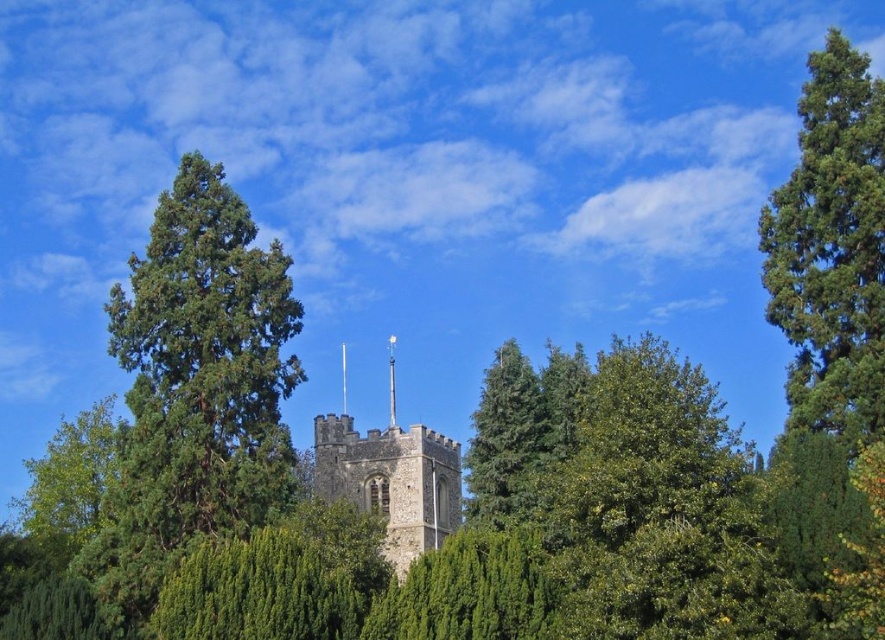
Can you confirm if green textured tree at left is thinner than green leafy tree at left?

Correct, green textured tree at left's width is less than green leafy tree at left's.

Is point (149, 432) farther from viewer compared to point (31, 477)?

No, (149, 432) is in front of (31, 477).

Identify the location of green textured tree at left. (195, 388).

Does point (378, 458) come closer to viewer compared to point (27, 531)?

That is False.

Locate an element on the screen. stone tower at center is located at coordinates (391, 476).

Is green textured tree at left below green textured pine tree at right?

Yes.

Looking at this image, which is more to the left, green textured tree at left or green textured pine tree at right?

green textured tree at left is more to the left.

Locate an element on the screen. The image size is (885, 640). green textured tree at left is located at coordinates (195, 388).